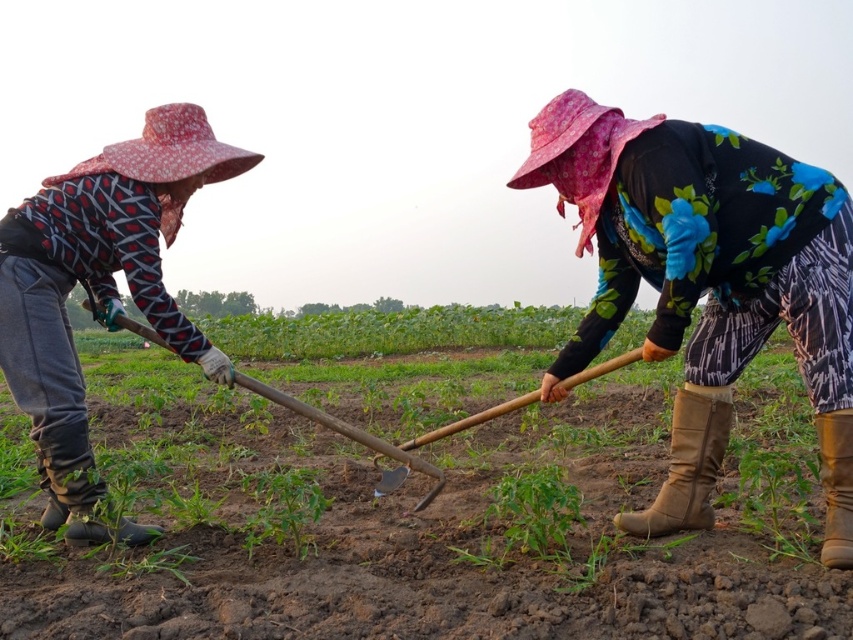
Question: In this image, where is brown suede boot at lower right located relative to wooden shovel at center?

Choices:
 (A) left
 (B) right

Answer: (B)

Question: Is brown leather boot at lower right in front of black rubber boot at lower left?

Choices:
 (A) yes
 (B) no

Answer: (B)

Question: Which of the following is the farthest from the observer?

Choices:
 (A) matte black shirt at left
 (B) brown suede boot at lower right
 (C) brown leather boot at lower right
 (D) black rubber boot at lower left

Answer: (C)

Question: Which of the following is the closest to the observer?

Choices:
 (A) (132, 541)
 (B) (9, 294)

Answer: (B)

Question: Among these objects, which one is farthest from the camera?

Choices:
 (A) black rubber boot at lower left
 (B) wooden shovel at center

Answer: (B)

Question: Does matte black shirt at left have a greater width compared to wooden shovel at center?

Choices:
 (A) yes
 (B) no

Answer: (B)